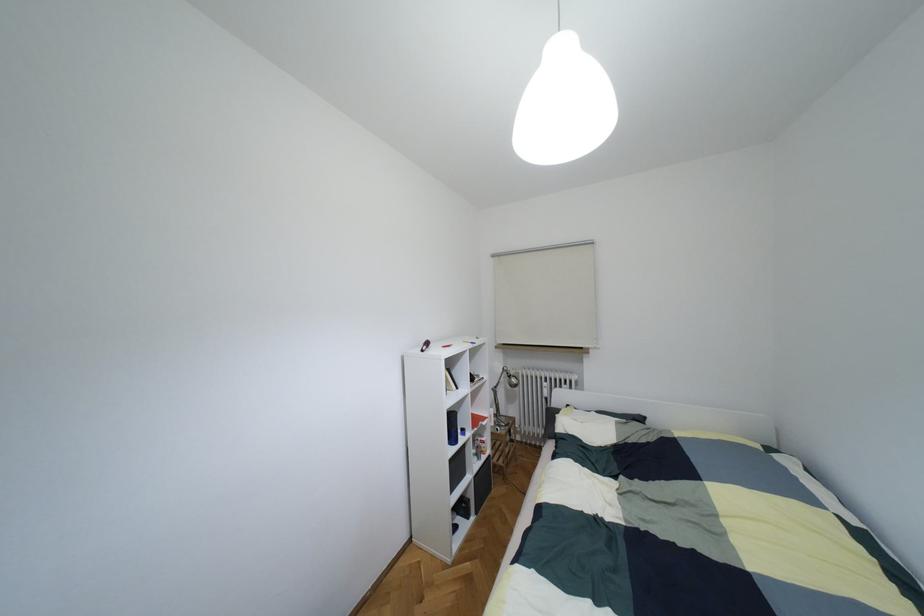
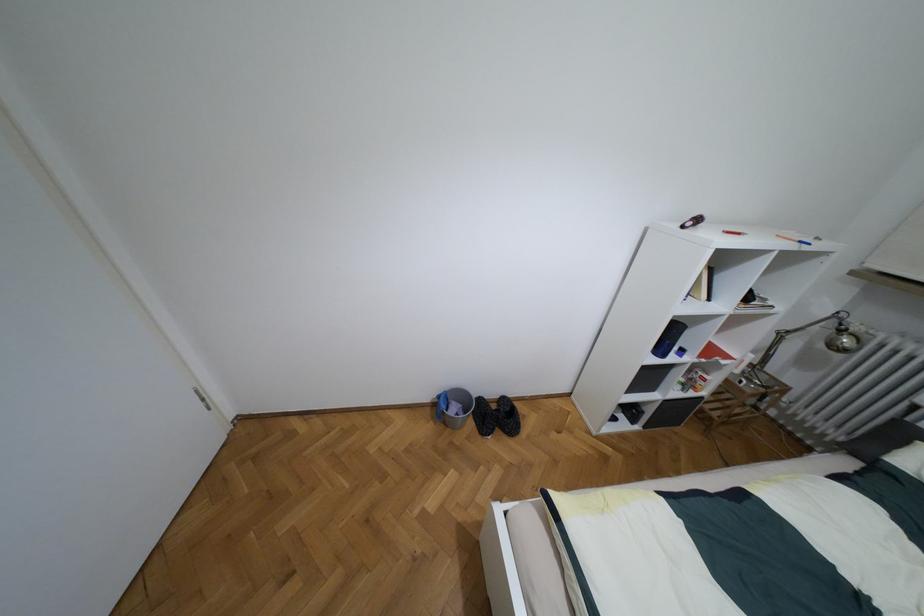
Where in the second image is the point corresponding to point 456,387 from the first image?

(709, 299)